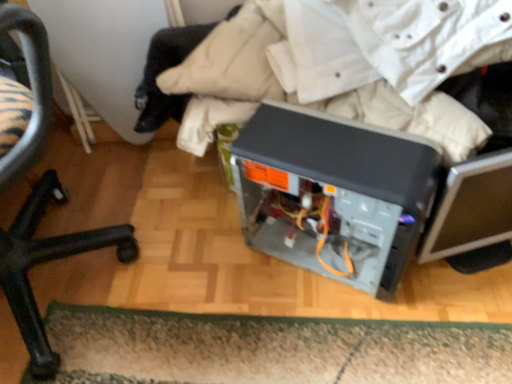
This screenshot has height=384, width=512. In order to click on vacant space situated on the left part of satin black computer case at center in this screenshot , I will do `click(220, 275)`.